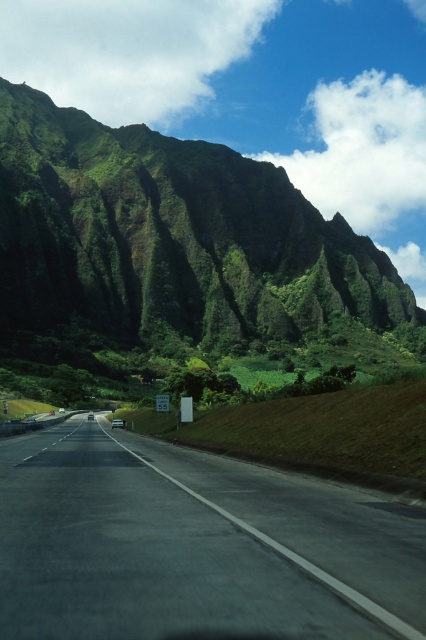
Question: Which object is closer to the camera taking this photo?

Choices:
 (A) green grassy mountain at upper left
 (B) black asphalt highway at center

Answer: (B)

Question: Does green grassy mountain at upper left lie behind black asphalt highway at center?

Choices:
 (A) no
 (B) yes

Answer: (B)

Question: Which of the following is the farthest from the observer?

Choices:
 (A) black asphalt highway at center
 (B) green grassy mountain at upper left

Answer: (B)

Question: Is green grassy mountain at upper left smaller than black asphalt highway at center?

Choices:
 (A) yes
 (B) no

Answer: (B)

Question: Does green grassy mountain at upper left have a smaller size compared to black asphalt highway at center?

Choices:
 (A) yes
 (B) no

Answer: (B)